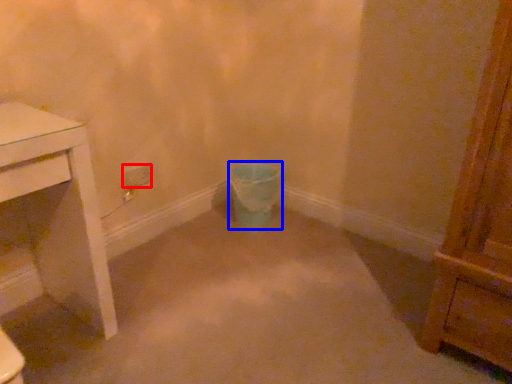
Question: Which object is further to the camera taking this photo, power plugs and sockets (highlighted by a red box) or toilet bowl (highlighted by a blue box)?

Choices:
 (A) power plugs and sockets
 (B) toilet bowl

Answer: (B)